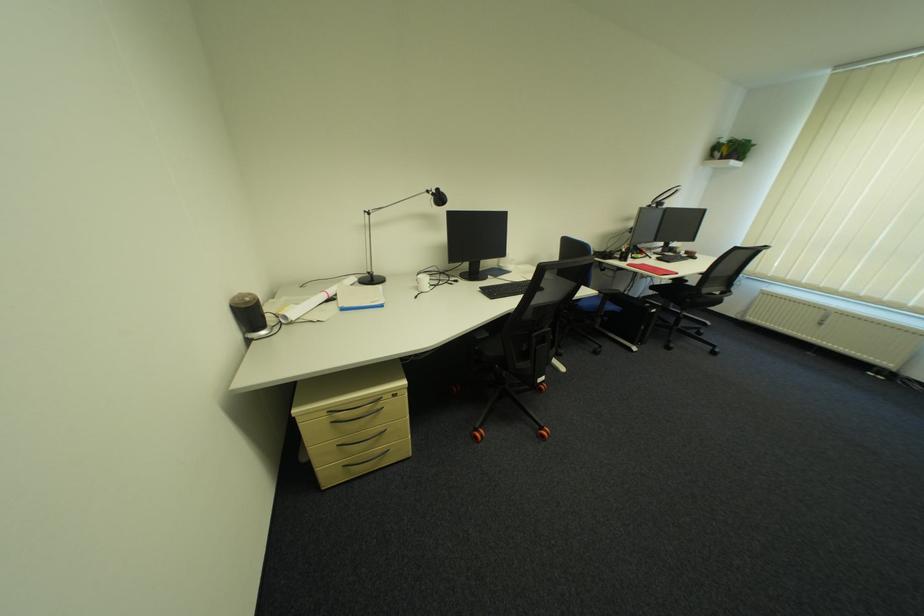
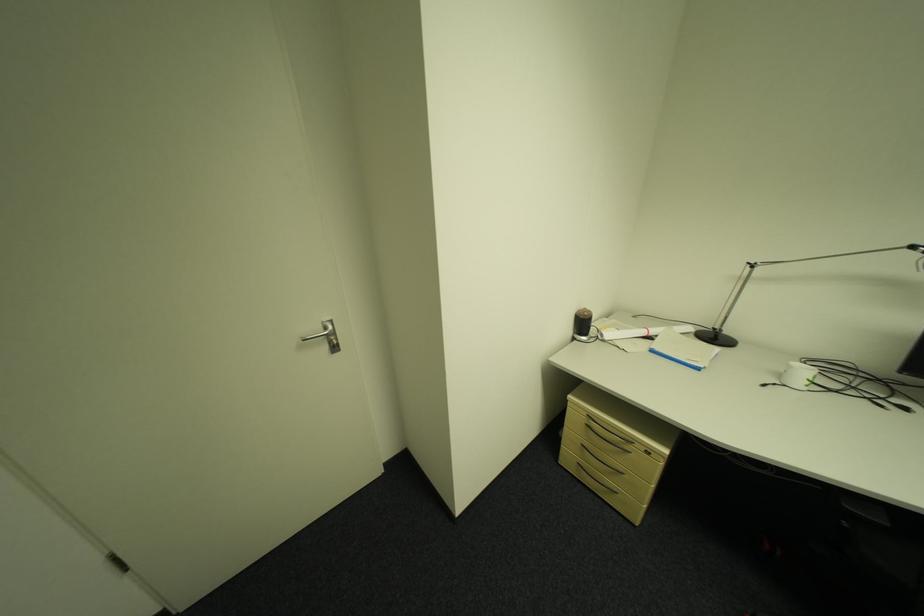
Where in the second image is the point corresponding to pixel 429 294 from the first image?

(784, 386)